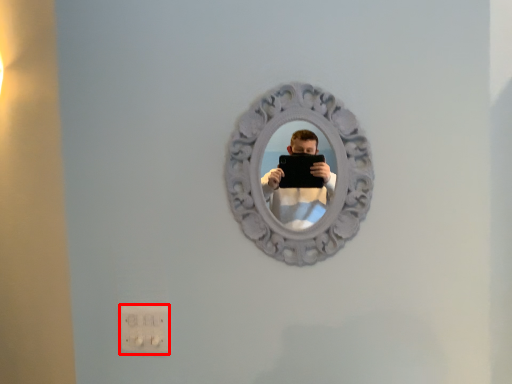
Question: Observing the image, what is the correct spatial positioning of electric outlet (annotated by the red box) in reference to view mirror?

Choices:
 (A) left
 (B) right

Answer: (A)